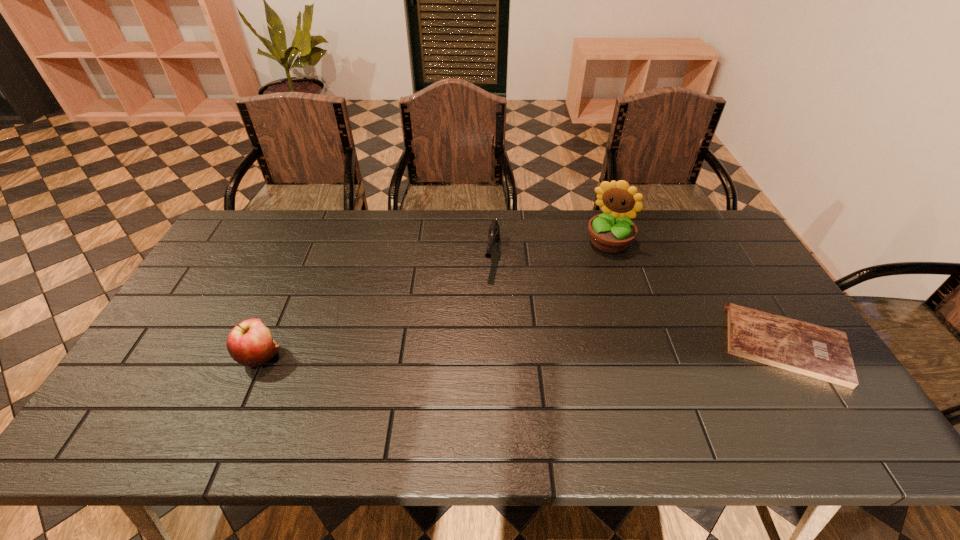
Where is `vacant space on the desktop that is between the leftmost object and the shortest object and is positioned on the face of the second object from right to left`? This screenshot has width=960, height=540. vacant space on the desktop that is between the leftmost object and the shortest object and is positioned on the face of the second object from right to left is located at coordinates (555, 350).

Where is `free space on the desktop that is between the apple and the shortest object and is positioned at the end of the barrel of the gun`? The width and height of the screenshot is (960, 540). free space on the desktop that is between the apple and the shortest object and is positioned at the end of the barrel of the gun is located at coordinates (472, 352).